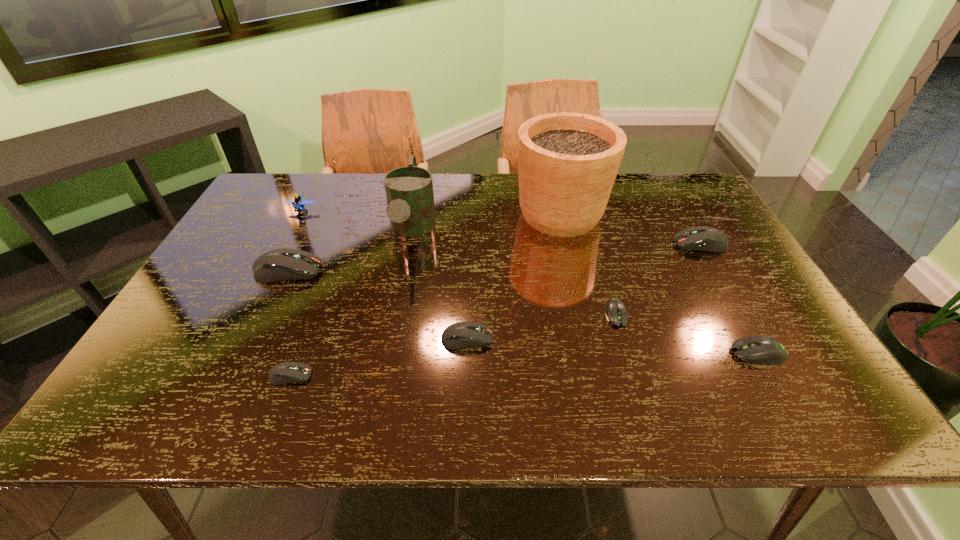
This screenshot has width=960, height=540. Find the location of `vacant space located on the button of the fifth tallest object`. vacant space located on the button of the fifth tallest object is located at coordinates (553, 244).

The image size is (960, 540). What are the coordinates of `free point located 0.360m on the button of the fifth tallest object` in the screenshot? It's located at (549, 244).

This screenshot has height=540, width=960. I want to click on free region located 0.400m on the button of the fifth tallest object, so click(x=536, y=244).

What are the coordinates of `vacant space positioned on the button of the second nearest dark computer equipment` in the screenshot? It's located at (615, 339).

Find the location of a particular element. vacant region located 0.160m on the wheel side of the bigger gray computer mouse is located at coordinates (660, 353).

Identify the location of free location located 0.210m on the wheel side of the bigger gray computer mouse. Image resolution: width=960 pixels, height=540 pixels. (636, 353).

In order to click on free point located 0.260m on the wheel side of the bigger gray computer mouse in this screenshot , I will do `click(614, 353)`.

Identify the location of vacant space located on the button of the nearest dark computer equipment. The height and width of the screenshot is (540, 960). (363, 376).

You are a GUI agent. You are given a task and a screenshot of the screen. Output one action in this format:
    pyautogui.click(x=<x>, y=<y>)
    Task: Click on the free spot located 0.200m on the wheel side of the third computer mouse from right to left
    This screenshot has width=960, height=540.
    Given the screenshot: What is the action you would take?
    pyautogui.click(x=643, y=404)

Where is `flowerpot that is positioned at the far edge`? The height and width of the screenshot is (540, 960). flowerpot that is positioned at the far edge is located at coordinates (567, 162).